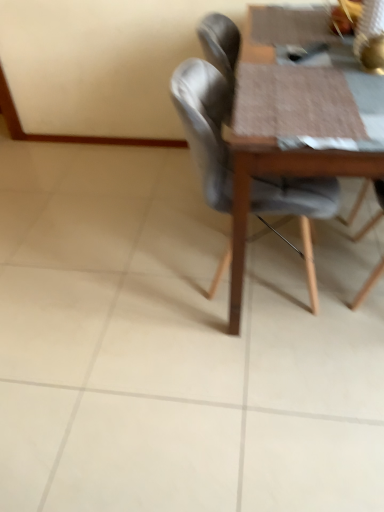
Question: Do you think matte gray chair at center is within wooden textured table at center, or outside of it?

Choices:
 (A) inside
 (B) outside

Answer: (A)

Question: Looking at the image, does matte gray chair at center seem bigger or smaller compared to wooden textured table at center?

Choices:
 (A) big
 (B) small

Answer: (B)

Question: Is matte gray chair at center in front of or behind wooden textured table at center in the image?

Choices:
 (A) behind
 (B) front

Answer: (A)

Question: From the image's perspective, is wooden textured table at center above or below matte gray chair at center?

Choices:
 (A) below
 (B) above

Answer: (B)

Question: Looking at their shapes, would you say wooden textured table at center is wider or thinner than matte gray chair at center?

Choices:
 (A) wide
 (B) thin

Answer: (A)

Question: In the image, is wooden textured table at center positioned in front of or behind matte gray chair at center?

Choices:
 (A) front
 (B) behind

Answer: (A)

Question: Based on their positions, is wooden textured table at center located to the left or right of matte gray chair at center?

Choices:
 (A) right
 (B) left

Answer: (A)